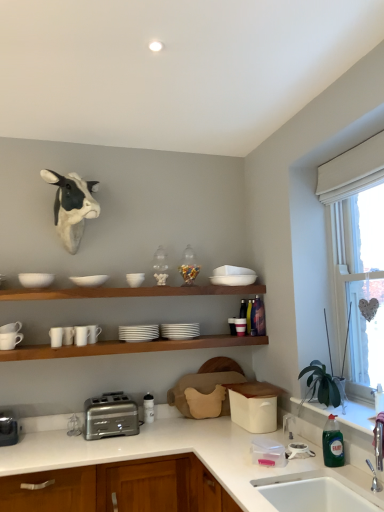
Question: From the image's perspective, is white matte mug at upper left, which ranks as the 7th tableware in right-to-left order, above or below white glossy countertop at lower center?

Choices:
 (A) above
 (B) below

Answer: (A)

Question: In the image, is white matte mug at upper left, which ranks as the 7th tableware in right-to-left order, positioned in front of or behind white glossy countertop at lower center?

Choices:
 (A) behind
 (B) front

Answer: (A)

Question: Which is farther from the white ceramic mug at left, which is the 8th tableware from right to left?

Choices:
 (A) white matte bowl at upper center, acting as the second mixing bowl starting from the left
 (B) brushed metal toaster at lower left, the 1th appliance positioned from the left
 (C) white glossy mug at left, placed as the 5th tableware when sorted from right to left
 (D) white matte mug at upper left, the 2th tableware positioned from the left
 (E) white ceramic sink at lower right, which appears as the first sink when ordered from the bottom

Answer: (E)

Question: Which object is positioned farthest from the white matte cups at left, positioned as the 6th tableware in right-to-left order?

Choices:
 (A) white matte cow head at upper left
 (B) white ceramic sink at lower right, the 2th sink in the bottom-to-top sequence
 (C) white matte plates at center, which is the seventh tableware in left-to-right order
 (D) white matte bowl at upper center, positioned as the first mixing bowl in right-to-left order
 (E) white glossy mug at left, which is the fourth tableware from left to right

Answer: (B)